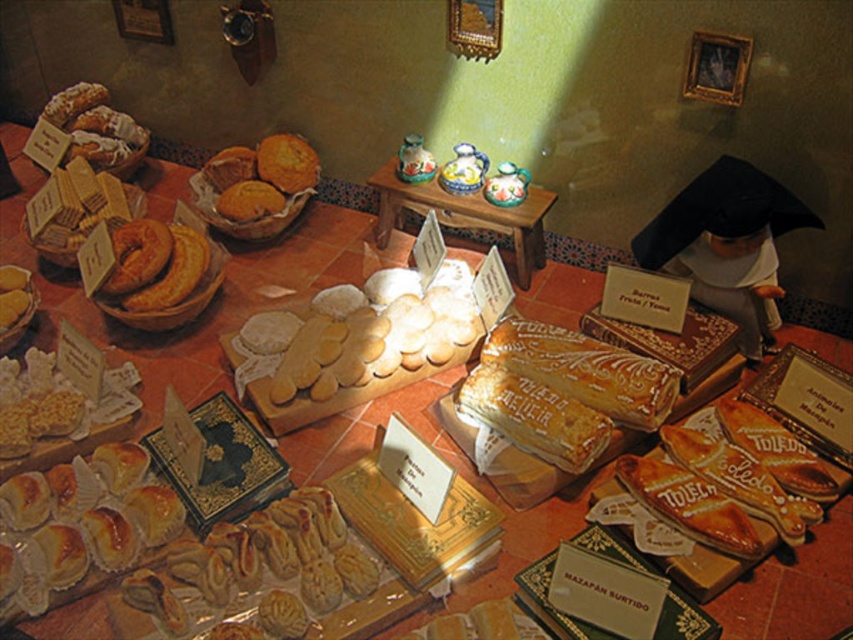
Question: Which of the following is the farthest from the observer?

Choices:
 (A) (291, 148)
 (B) (521, 234)

Answer: (A)

Question: Which point is farther to the camera?

Choices:
 (A) golden crumbly muffins at center
 (B) wooden table at center

Answer: (A)

Question: Is wooden table at center positioned before golden crumbly muffins at center?

Choices:
 (A) yes
 (B) no

Answer: (A)

Question: Does wooden table at center appear on the right side of golden crumbly muffins at center?

Choices:
 (A) no
 (B) yes

Answer: (B)

Question: Does wooden table at center appear on the right side of golden crumbly muffins at center?

Choices:
 (A) no
 (B) yes

Answer: (B)

Question: Among these objects, which one is nearest to the camera?

Choices:
 (A) golden crumbly muffins at center
 (B) wooden table at center

Answer: (B)